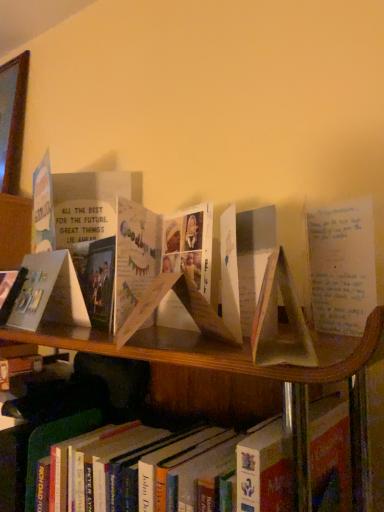
Question: Can you see hardcover book at lower center touching matte paper card at left, acting as the first paperback book starting from the back?

Choices:
 (A) no
 (B) yes

Answer: (A)

Question: Is hardcover book at lower center positioned in front of matte paper card at left, acting as the first paperback book starting from the back?

Choices:
 (A) yes
 (B) no

Answer: (A)

Question: Does hardcover book at lower center contain matte paper card at left, which is the first paperback book from left to right?

Choices:
 (A) yes
 (B) no

Answer: (B)

Question: Can you confirm if hardcover book at lower center is taller than matte paper card at left, the 2th paperback book viewed from the front?

Choices:
 (A) yes
 (B) no

Answer: (A)

Question: Considering the relative positions of hardcover book at lower center and matte paper card at left, which is the first paperback book from left to right, in the image provided, is hardcover book at lower center to the left of matte paper card at left, which is the first paperback book from left to right, from the viewer's perspective?

Choices:
 (A) no
 (B) yes

Answer: (A)

Question: From the image's perspective, is hardcover book at lower center located above matte paper card at left, marked as the 2th paperback book in a right-to-left arrangement?

Choices:
 (A) no
 (B) yes

Answer: (A)

Question: Considering the relative sizes of matte paper card at left, which is the first paperback book from left to right, and matte paper book at center, which is the first paperback book in right-to-left order, in the image provided, is matte paper card at left, which is the first paperback book from left to right, taller than matte paper book at center, which is the first paperback book in right-to-left order,?

Choices:
 (A) yes
 (B) no

Answer: (A)

Question: Considering the relative positions of matte paper card at left, which is the first paperback book from left to right, and matte paper book at center, which is counted as the 2th paperback book, starting from the back, in the image provided, is matte paper card at left, which is the first paperback book from left to right, to the right of matte paper book at center, which is counted as the 2th paperback book, starting from the back, from the viewer's perspective?

Choices:
 (A) yes
 (B) no

Answer: (B)

Question: Can you confirm if matte paper card at left, which is the first paperback book from left to right, is shorter than matte paper book at center, which is counted as the 2th paperback book, starting from the back?

Choices:
 (A) yes
 (B) no

Answer: (B)

Question: Can you confirm if matte paper card at left, which is the first paperback book from left to right, is smaller than matte paper book at center, positioned as the 1th paperback book in front-to-back order?

Choices:
 (A) no
 (B) yes

Answer: (A)

Question: Considering the relative sizes of matte paper card at left, marked as the 2th paperback book in a right-to-left arrangement, and matte paper book at center, which is counted as the 2th paperback book, starting from the back, in the image provided, is matte paper card at left, marked as the 2th paperback book in a right-to-left arrangement, thinner than matte paper book at center, which is counted as the 2th paperback book, starting from the back,?

Choices:
 (A) yes
 (B) no

Answer: (A)

Question: Are matte paper card at left, acting as the first paperback book starting from the back, and matte paper book at center, which is counted as the 2th paperback book, starting from the back, making contact?

Choices:
 (A) no
 (B) yes

Answer: (A)

Question: From a real-world perspective, does hardcover book at lower center sit lower than matte paper book at center, which is counted as the 2th paperback book, starting from the back?

Choices:
 (A) no
 (B) yes

Answer: (B)